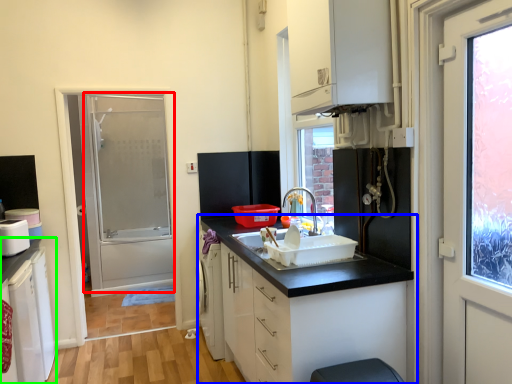
Question: Estimate the real-world distances between objects in this image. Which object is farther from screen door (highlighted by a red box), cabinetry (highlighted by a blue box) or cabinetry (highlighted by a green box)?

Choices:
 (A) cabinetry
 (B) cabinetry

Answer: (A)